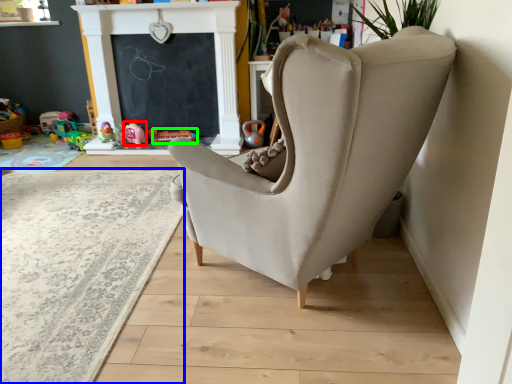
Question: Based on their relative distances, which object is nearer to toy (highlighted by a red box)? Choose from plain (highlighted by a blue box) and toy (highlighted by a green box).

Choices:
 (A) plain
 (B) toy

Answer: (B)